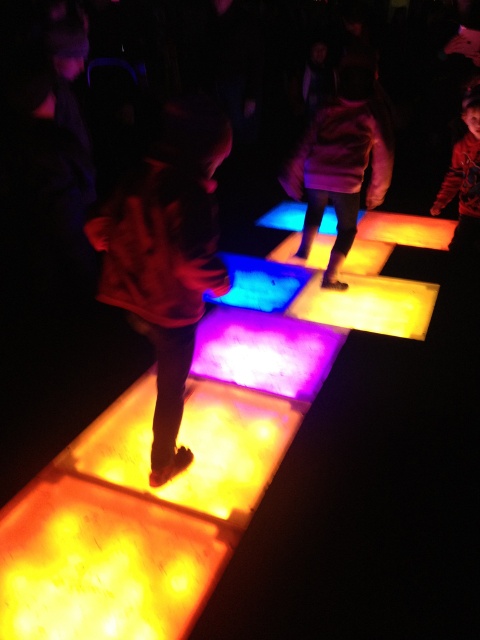
In the scene shown: You are a parent trying to guide your child through the maze of glowing tiles. The child is currently standing on the translucent glowing square at center. You want them to move to the matte orange square at center. Which direction should they go?

The translucent glowing square at center is below the matte orange square at center, so the child should move upward to reach the matte orange square at center.